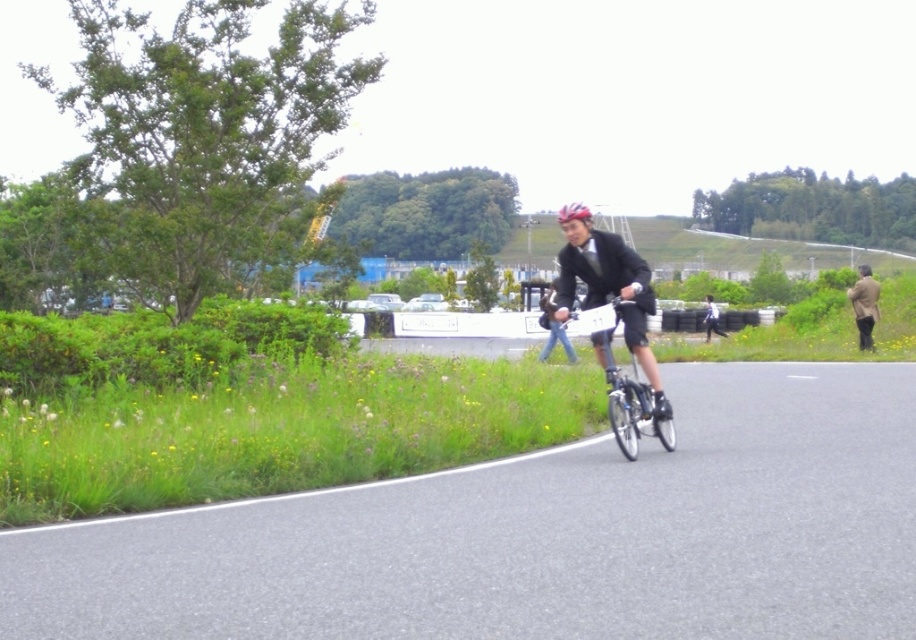
Question: Among these points, which one is farthest from the camera?

Choices:
 (A) (598, 259)
 (B) (867, 276)

Answer: (B)

Question: Which object is farther from the camera taking this photo?

Choices:
 (A) brown leather jacket at right
 (B) matte black suit at center

Answer: (A)

Question: Does matte black suit at center appear over shiny blue helmet at center?

Choices:
 (A) no
 (B) yes

Answer: (A)

Question: Does matte black suit at center lie behind brown leather jacket at right?

Choices:
 (A) yes
 (B) no

Answer: (B)

Question: Is brown leather jacket at right closer to the viewer compared to shiny blue helmet at center?

Choices:
 (A) yes
 (B) no

Answer: (B)

Question: Among these objects, which one is farthest from the camera?

Choices:
 (A) silver metallic bicycle at center
 (B) matte black suit at center
 (C) shiny blue helmet at center
 (D) brown leather jacket at right

Answer: (D)